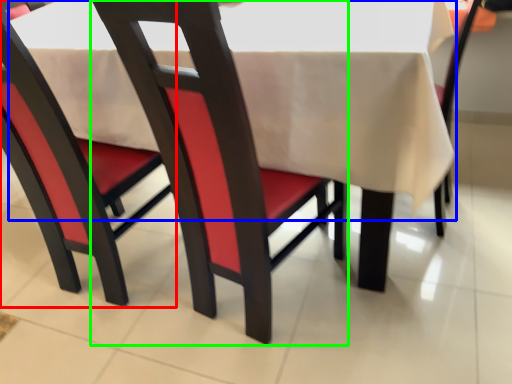
Question: Which object is the closest to the chair (highlighted by a red box)? Choose among these: tablecloth (highlighted by a blue box) or chair (highlighted by a green box).

Choices:
 (A) tablecloth
 (B) chair

Answer: (A)